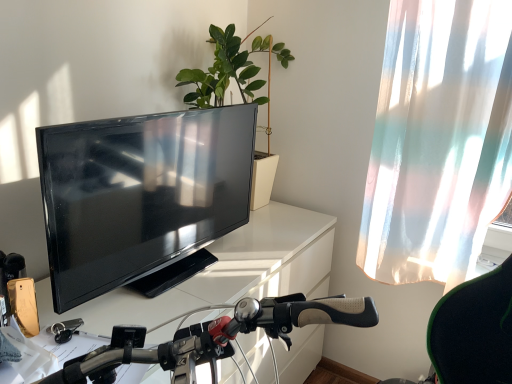
What are the coordinates of `vacant space situated above white glossy desk at center (from a real-world perspective)` in the screenshot? It's located at (218, 254).